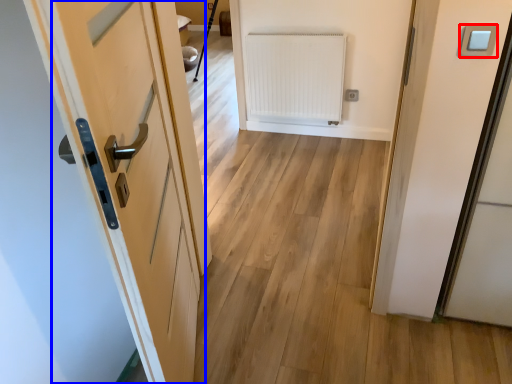
Question: Among these objects, which one is farthest to the camera, light switch (highlighted by a red box) or door (highlighted by a blue box)?

Choices:
 (A) light switch
 (B) door

Answer: (A)